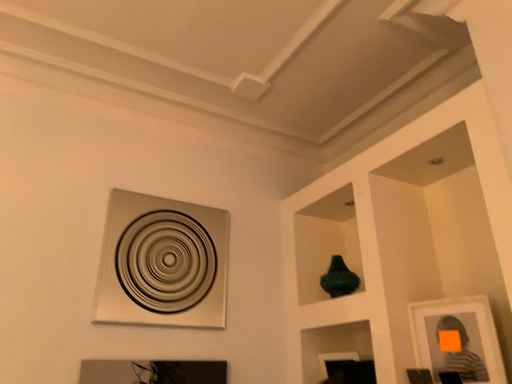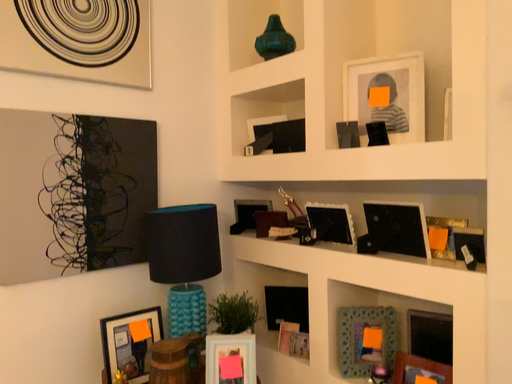
Question: Which way did the camera rotate in the video?

Choices:
 (A) rotated right
 (B) rotated left

Answer: (A)